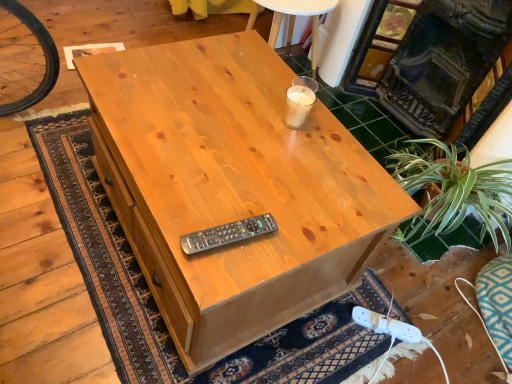
The height and width of the screenshot is (384, 512). Identify the location of vacant area that lies between natural wood desk at center and white plastic plug at lower right. (332, 333).